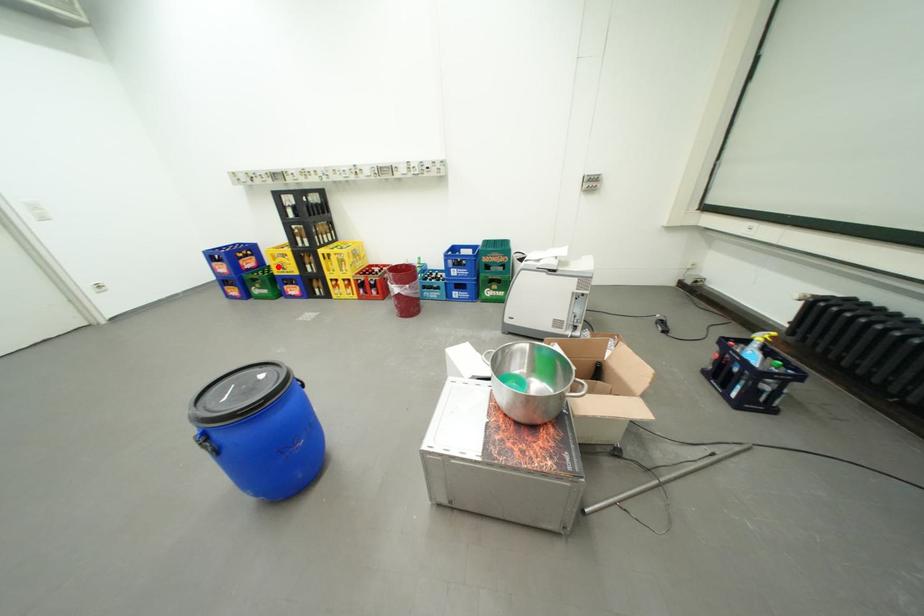
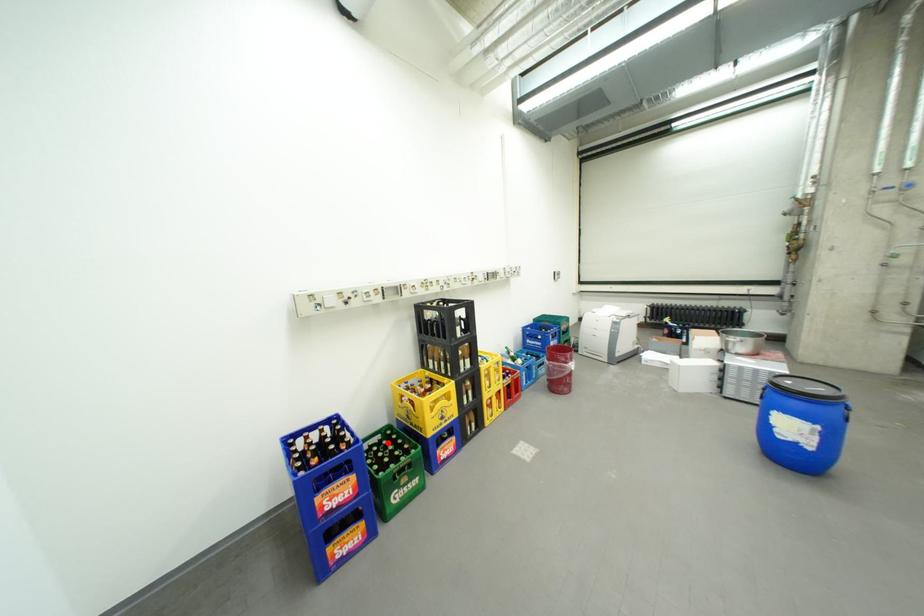
I am providing you with two images of the same scene from different viewpoints. A red point is marked on the first image and another point is marked on the second image. Do the highlighted points in image1 and image2 indicate the same real-world spot?

Yes